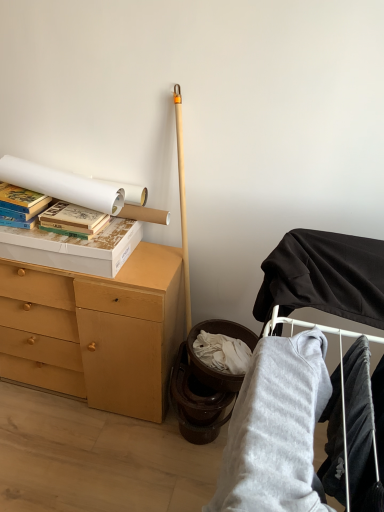
Question: Is hardcover books at left, marked as the first paperback book in a left-to-right arrangement, positioned in front of velvet black pants at lower right, positioned as the first clothing in right-to-left order?

Choices:
 (A) yes
 (B) no

Answer: (B)

Question: Is there a large distance between hardcover books at left, marked as the first paperback book in a left-to-right arrangement, and velvet black pants at lower right, the 2th clothing from the left?

Choices:
 (A) yes
 (B) no

Answer: (A)

Question: From a real-world perspective, is hardcover books at left, marked as the first paperback book in a left-to-right arrangement, below velvet black pants at lower right, the 2th clothing from the left?

Choices:
 (A) yes
 (B) no

Answer: (B)

Question: From the image's perspective, is hardcover books at left, marked as the first paperback book in a left-to-right arrangement, over velvet black pants at lower right, the 2th clothing from the left?

Choices:
 (A) no
 (B) yes

Answer: (B)

Question: Considering the relative sizes of hardcover books at left, which is counted as the 2th paperback book, starting from the right, and velvet black pants at lower right, the 2th clothing from the left, in the image provided, is hardcover books at left, which is counted as the 2th paperback book, starting from the right, smaller than velvet black pants at lower right, the 2th clothing from the left,?

Choices:
 (A) no
 (B) yes

Answer: (A)

Question: Considering the relative positions of hardcover books at left, which is counted as the 2th paperback book, starting from the right, and velvet black pants at lower right, positioned as the first clothing in right-to-left order, in the image provided, is hardcover books at left, which is counted as the 2th paperback book, starting from the right, behind velvet black pants at lower right, positioned as the first clothing in right-to-left order,?

Choices:
 (A) no
 (B) yes

Answer: (B)

Question: Is matte cardboard book at upper left, which is the first paperback book from right to left, oriented away from white cardboard box at upper left?

Choices:
 (A) no
 (B) yes

Answer: (A)

Question: Is matte cardboard book at upper left, the 2th paperback book viewed from the left, oriented towards white cardboard box at upper left?

Choices:
 (A) no
 (B) yes

Answer: (A)

Question: Can you confirm if matte cardboard book at upper left, which is the first paperback book from right to left, is taller than white cardboard box at upper left?

Choices:
 (A) yes
 (B) no

Answer: (B)

Question: Is matte cardboard book at upper left, the 2th paperback book viewed from the left, behind white cardboard box at upper left?

Choices:
 (A) yes
 (B) no

Answer: (A)

Question: Is matte cardboard book at upper left, the 2th paperback book viewed from the left, located outside white cardboard box at upper left?

Choices:
 (A) no
 (B) yes

Answer: (A)

Question: Does matte cardboard book at upper left, which is the first paperback book from right to left, appear on the right side of white cardboard box at upper left?

Choices:
 (A) no
 (B) yes

Answer: (B)

Question: Is the depth of matte cardboard book at upper left, which is the first paperback book from right to left, greater than that of gray fleece sweatshirt at lower right, the 1th clothing positioned from the left?

Choices:
 (A) yes
 (B) no

Answer: (A)